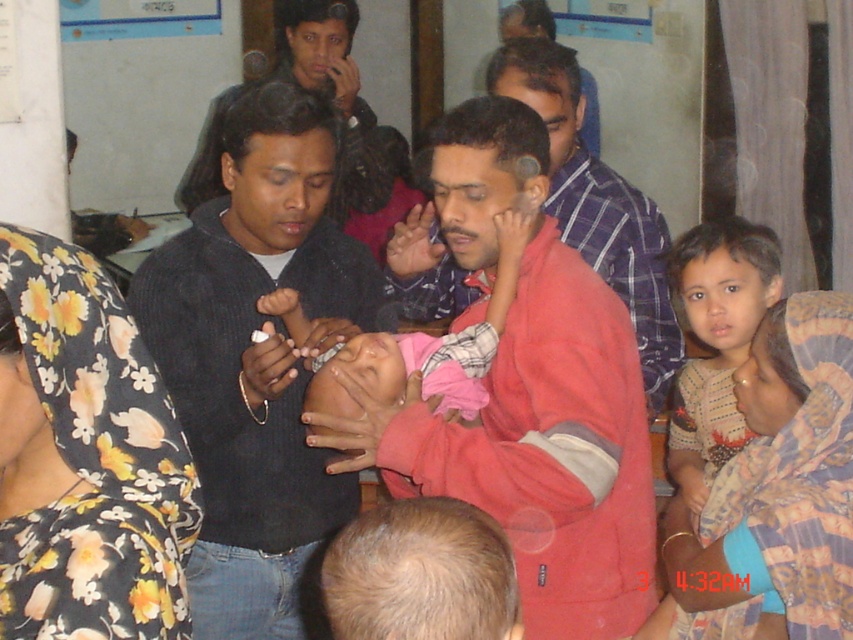
You are a photographer trying to capture a candid shot of the baby. You are positioned at point (213,448) and want to move closer to the baby, who is near point (520,307). Is the path between these two points clear of any obstacles?

Point (520,307) is in front of point (213,448), so the path between them is clear as there are no objects blocking the way between these two points.

You are a photographer at the event and want to take a photo that includes both the printed fabric baby at center and the light brown fabric shirt at right. Based on their positions, which object should be placed on the left side of the photo frame?

The printed fabric baby at center should be placed on the left side of the photo frame because it is positioned on the left side of the light brown fabric shirt at right in the scene.

You are a photographer standing at the camera position. You want to capture a closeup shot of the red fleece jacket at center. Considering your current position, do you think you need to move closer or farther away to achieve this?

The red fleece jacket at center is 5.60 feet away from the camera. To capture a closeup shot, you would need to move closer to reduce the distance between the camera and the jacket.